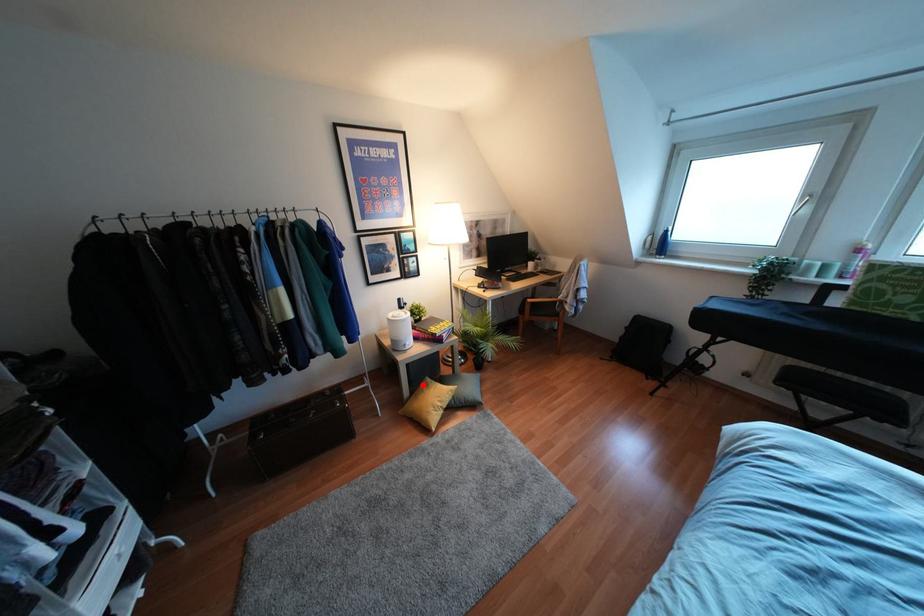
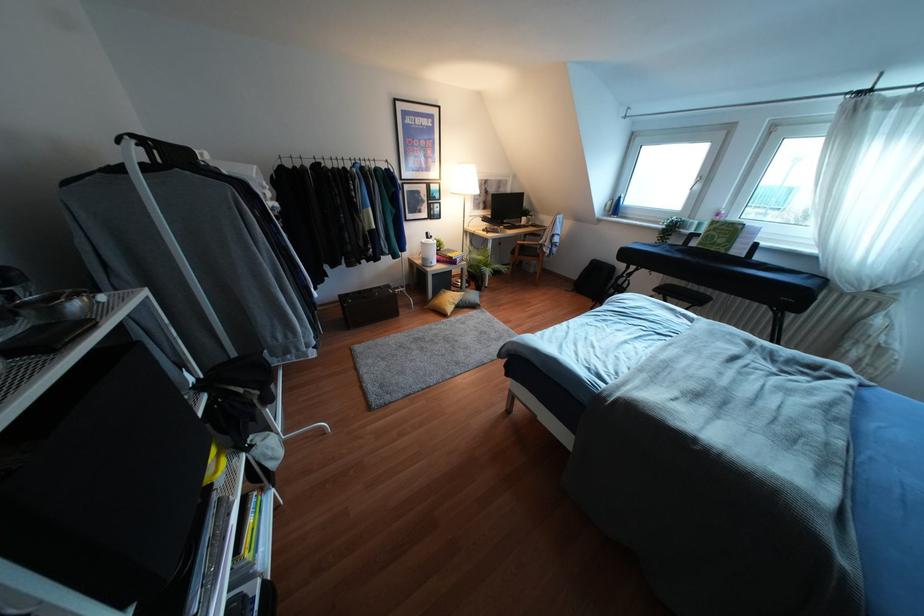
Question: A red point is marked in image1. In image2, is the corresponding 3D point closer to the camera or farther? Reply with the corresponding letter.

Choices:
 (A) The corresponding 3D point is closer.
 (B) The corresponding 3D point is farther.

Answer: (A)